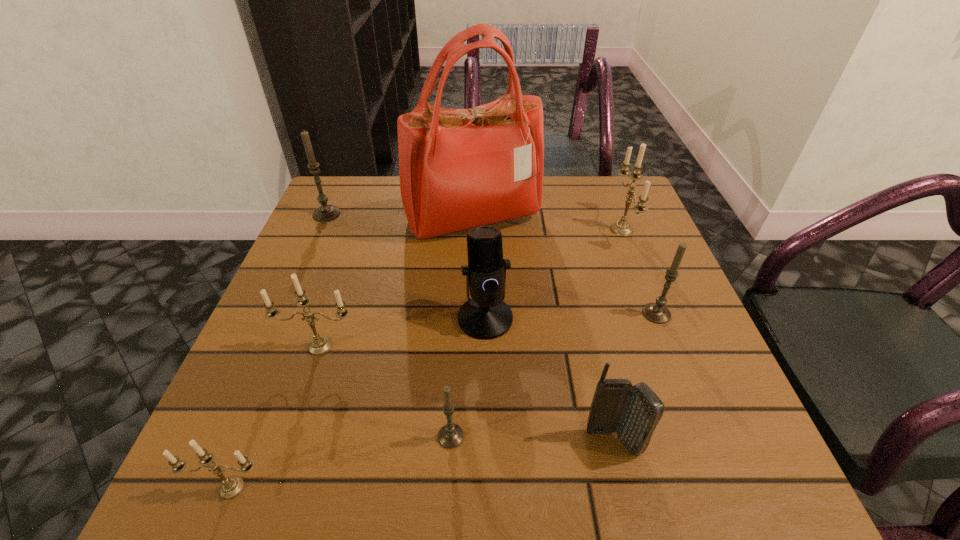
Where is `free point that satisfies the following two spatial constraints: 1. on the front side of the biggest gray candle; 2. on the left side of the farthest metallic candle`? free point that satisfies the following two spatial constraints: 1. on the front side of the biggest gray candle; 2. on the left side of the farthest metallic candle is located at coordinates (320, 230).